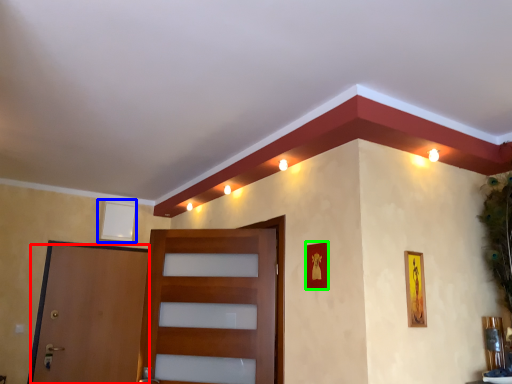
Question: Which object is the farthest from door (highlighted by a red box)? Choose among these: picture frame (highlighted by a blue box) or picture frame (highlighted by a green box).

Choices:
 (A) picture frame
 (B) picture frame

Answer: (B)